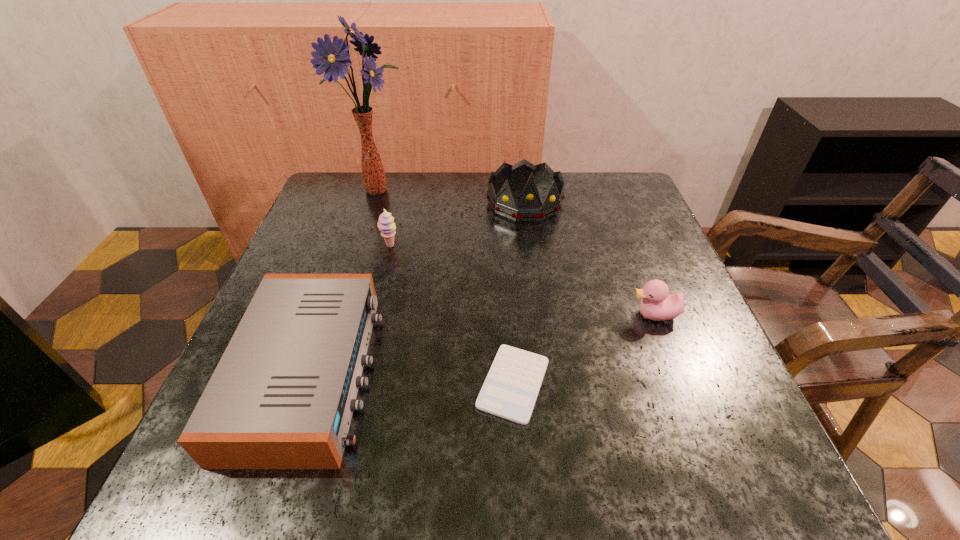
Identify the location of free space located 0.400m on the front-facing side of the duckling. (425, 315).

Identify the location of free spot located on the front-facing side of the duckling. Image resolution: width=960 pixels, height=540 pixels. (563, 315).

The height and width of the screenshot is (540, 960). What are the coordinates of `vacant region located 0.210m on the front-facing side of the duckling` in the screenshot? It's located at (522, 315).

Find the location of a particular element. This screenshot has width=960, height=540. free location located on the front panel of the radio receiver is located at coordinates (488, 373).

At what (x,y) coordinates should I click in order to perform the action: click on free region located on the right of the shortest object. Please return your answer as a coordinate pair (x, y). The width and height of the screenshot is (960, 540). Looking at the image, I should click on (621, 384).

You are a GUI agent. You are given a task and a screenshot of the screen. Output one action in this format:
    pyautogui.click(x=<x>, y=<y>)
    Task: Click on the flower arrangement present at the far edge
    
    Given the screenshot: What is the action you would take?
    pyautogui.click(x=332, y=58)

Identify the location of tiara present at the far edge. This screenshot has height=540, width=960. (529, 208).

Where is `object that is at the near edge`? Image resolution: width=960 pixels, height=540 pixels. object that is at the near edge is located at coordinates (282, 396).

This screenshot has height=540, width=960. What are the coordinates of `flower arrangement that is positioned at the left edge` in the screenshot? It's located at (332, 58).

Identify the location of radio receiver present at the left edge. (282, 396).